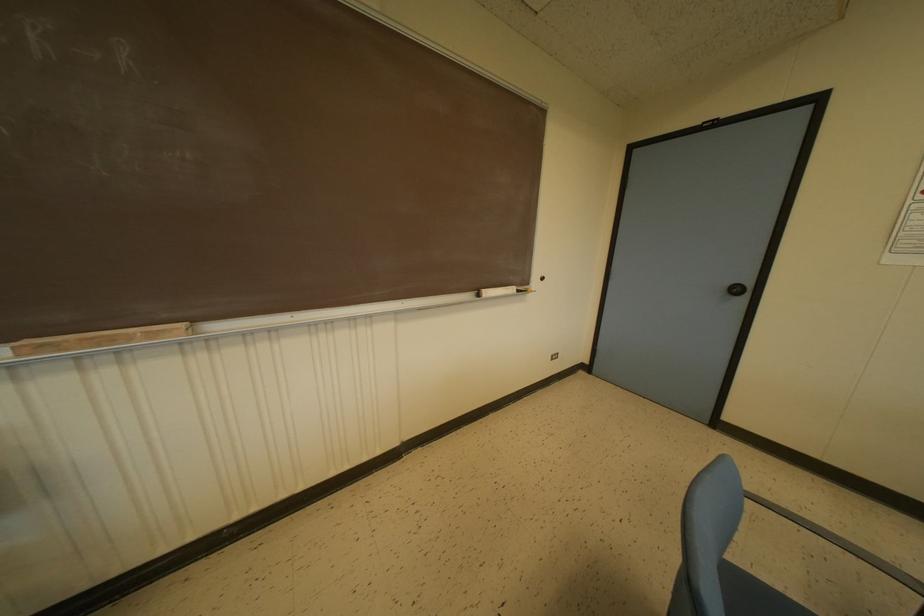
I want to click on black door knob, so click(x=736, y=289).